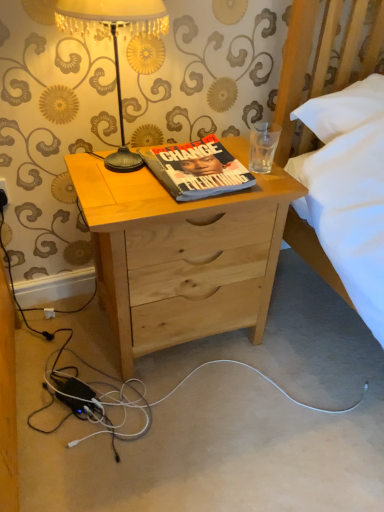
This screenshot has width=384, height=512. In order to click on vacant space that's between gold textured lampshade at upper left and hardcover book at center in this screenshot , I will do `click(144, 192)`.